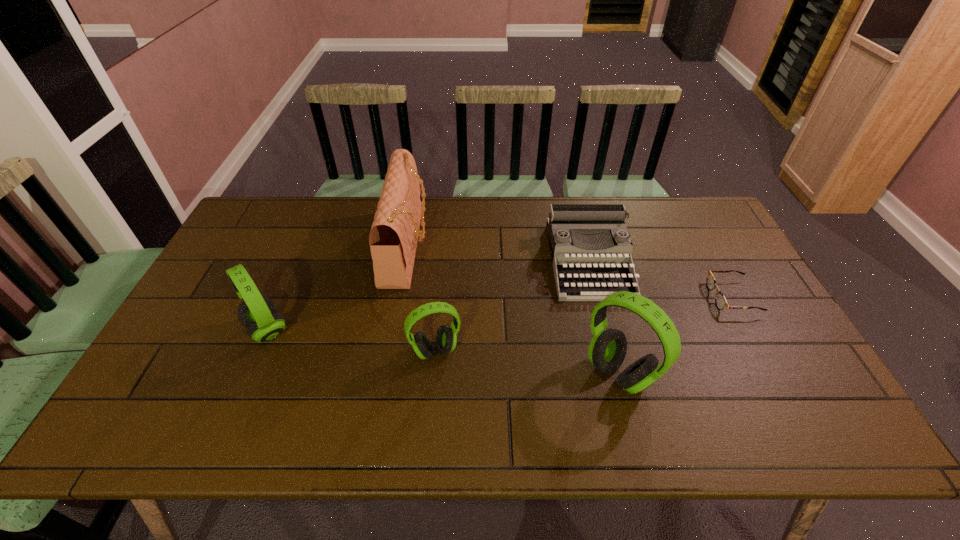
I want to click on vacant area that lies between the third shortest object and the second shortest headset, so click(351, 340).

Find the location of a particular element. The height and width of the screenshot is (540, 960). unoccupied area between the fifth tallest object and the spectacles is located at coordinates pyautogui.click(x=660, y=279).

The image size is (960, 540). I want to click on free space between the shortest headset and the second tallest headset, so click(351, 340).

This screenshot has height=540, width=960. I want to click on vacant region between the typewriter and the handbag, so click(498, 254).

Where is `object that stands as the fifth closest to the second headset from left to right`? object that stands as the fifth closest to the second headset from left to right is located at coordinates (720, 300).

Where is `object that stands as the second closest to the handbag`? The height and width of the screenshot is (540, 960). object that stands as the second closest to the handbag is located at coordinates (258, 313).

Choose which headset is the second nearest neighbor to the typewriter. Please provide its 2D coordinates. Your answer should be formatted as a tuple, i.e. [(x, y)], where the tuple contains the x and y coordinates of a point satisfying the conditions above.

[(446, 339)]

Find the location of a particular element. This screenshot has height=540, width=960. headset that is the second closest to the second shortest headset is located at coordinates (607, 350).

Locate an element on the screen. This screenshot has width=960, height=540. free space that satisfies the following two spatial constraints: 1. on the typing side of the fifth tallest object; 2. on the right side of the tallest headset is located at coordinates (618, 374).

Where is `free location that satisfies the following two spatial constraints: 1. on the frame of the spectacles; 2. on the front side of the second headset from right to left`? free location that satisfies the following two spatial constraints: 1. on the frame of the spectacles; 2. on the front side of the second headset from right to left is located at coordinates (761, 351).